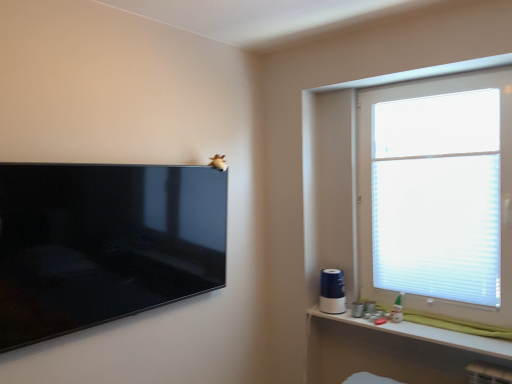
Image resolution: width=512 pixels, height=384 pixels. In order to click on free space above white translucent blinds at upper right (from a real-world perspective) in this screenshot , I will do `click(429, 78)`.